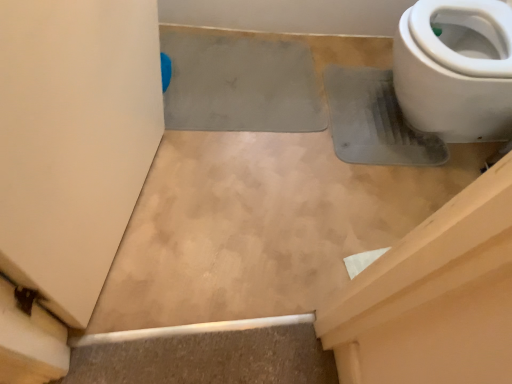
This screenshot has width=512, height=384. Describe the element at coordinates (456, 69) in the screenshot. I see `white glossy toilet at upper right` at that location.

Locate an element on the screen. This screenshot has height=384, width=512. white glossy toilet at upper right is located at coordinates (456, 69).

Describe the element at coordinates (239, 83) in the screenshot. I see `gray rubber mat at center` at that location.

Where is `gray rubber mat at center`? gray rubber mat at center is located at coordinates point(239,83).

Measure the distance between gray rubber mat at center and camera.

gray rubber mat at center and camera are 4.95 feet apart from each other.

What is the approximate width of gray rubber mat at center?

gray rubber mat at center is 20.48 inches wide.

You are a GUI agent. You are given a task and a screenshot of the screen. Output one action in this format:
    pyautogui.click(x=<x>, y=<y>)
    Task: Click on the white glossy toilet at upper right
    
    Given the screenshot: What is the action you would take?
    pyautogui.click(x=456, y=69)

Between white glossy toilet at upper right and gray rubber mat at center, which one appears on the left side from the viewer's perspective?

gray rubber mat at center.

Considering the positions of objects white glossy toilet at upper right and gray rubber mat at center in the image provided, who is in front, white glossy toilet at upper right or gray rubber mat at center?

white glossy toilet at upper right is in front.

Is point (429, 108) positioned before point (179, 67)?

Yes, point (429, 108) is in front of point (179, 67).

From the image's perspective, who appears lower, white glossy toilet at upper right or gray rubber mat at center?

gray rubber mat at center is shown below in the image.

From a real-world perspective, is white glossy toilet at upper right beneath gray rubber mat at center?

No.

Which object is thinner, white glossy toilet at upper right or gray rubber mat at center?

gray rubber mat at center.

Does white glossy toilet at upper right have a greater height compared to gray rubber mat at center?

Yes.

Considering the relative sizes of white glossy toilet at upper right and gray rubber mat at center in the image provided, is white glossy toilet at upper right bigger than gray rubber mat at center?

Correct, white glossy toilet at upper right is larger in size than gray rubber mat at center.

Does white glossy toilet at upper right contain gray rubber mat at center?

No, gray rubber mat at center is not a part of white glossy toilet at upper right.

Is white glossy toilet at upper right positioned far away from gray rubber mat at center?

white glossy toilet at upper right is near gray rubber mat at center, not far away.

Is white glossy toilet at upper right facing towards gray rubber mat at center?

Yes, white glossy toilet at upper right is facing gray rubber mat at center.

How different are the orientations of white glossy toilet at upper right and gray rubber mat at center in degrees?

The angle between the facing direction of white glossy toilet at upper right and the facing direction of gray rubber mat at center is 91.4 degrees.

Measure the distance between white glossy toilet at upper right and gray rubber mat at center.

white glossy toilet at upper right and gray rubber mat at center are 54.71 centimeters apart.

The image size is (512, 384). I want to click on toilet on the right side of gray rubber mat at center, so click(x=456, y=69).

Can you confirm if gray rubber mat at center is positioned to the right of white glossy toilet at upper right?

Incorrect, gray rubber mat at center is not on the right side of white glossy toilet at upper right.

Considering their positions, is gray rubber mat at center located in front of or behind white glossy toilet at upper right?

Visually, gray rubber mat at center is located behind white glossy toilet at upper right.

Is point (179, 48) closer to viewer compared to point (453, 124)?

No, it is behind (453, 124).

From the image's perspective, is gray rubber mat at center located above or below white glossy toilet at upper right?

gray rubber mat at center is below white glossy toilet at upper right.

From a real-world perspective, between gray rubber mat at center and white glossy toilet at upper right, who is vertically higher?

white glossy toilet at upper right, from a real-world perspective.

Does gray rubber mat at center have a lesser width compared to white glossy toilet at upper right?

Correct, the width of gray rubber mat at center is less than that of white glossy toilet at upper right.

Considering the sizes of gray rubber mat at center and white glossy toilet at upper right in the image, is gray rubber mat at center taller or shorter than white glossy toilet at upper right?

In the image, gray rubber mat at center appears to be shorter than white glossy toilet at upper right.

Considering the sizes of objects gray rubber mat at center and white glossy toilet at upper right in the image provided, who is bigger, gray rubber mat at center or white glossy toilet at upper right?

Bigger between the two is white glossy toilet at upper right.

Do you think gray rubber mat at center is within white glossy toilet at upper right, or outside of it?

gray rubber mat at center exists outside the volume of white glossy toilet at upper right.

Is gray rubber mat at center directly adjacent to white glossy toilet at upper right?

No, gray rubber mat at center is not touching white glossy toilet at upper right.

Is gray rubber mat at center facing towards white glossy toilet at upper right?

No, gray rubber mat at center is not turned towards white glossy toilet at upper right.

How different are the orientations of gray rubber mat at center and white glossy toilet at upper right in degrees?

The angular difference between gray rubber mat at center and white glossy toilet at upper right is 91.4 degrees.

Identify the location of concrete that is under the white glossy toilet at upper right (from a real-world perspective). (239, 83).

Image resolution: width=512 pixels, height=384 pixels. I want to click on toilet positioned vertically above the gray rubber mat at center (from a real-world perspective), so click(x=456, y=69).

Find the location of `concrete that appears below the white glossy toilet at upper right (from a real-world perspective)`. concrete that appears below the white glossy toilet at upper right (from a real-world perspective) is located at coordinates (239, 83).